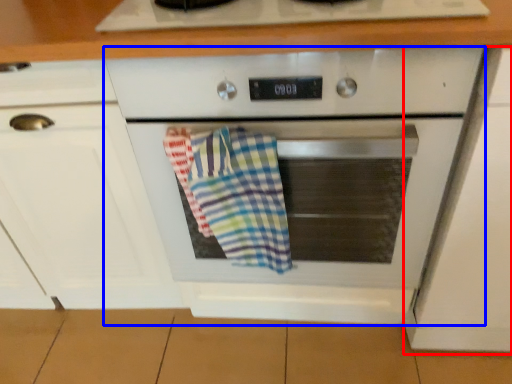
Question: Which object is further to the camera taking this photo, cabinetry (highlighted by a red box) or oven (highlighted by a blue box)?

Choices:
 (A) cabinetry
 (B) oven

Answer: (B)